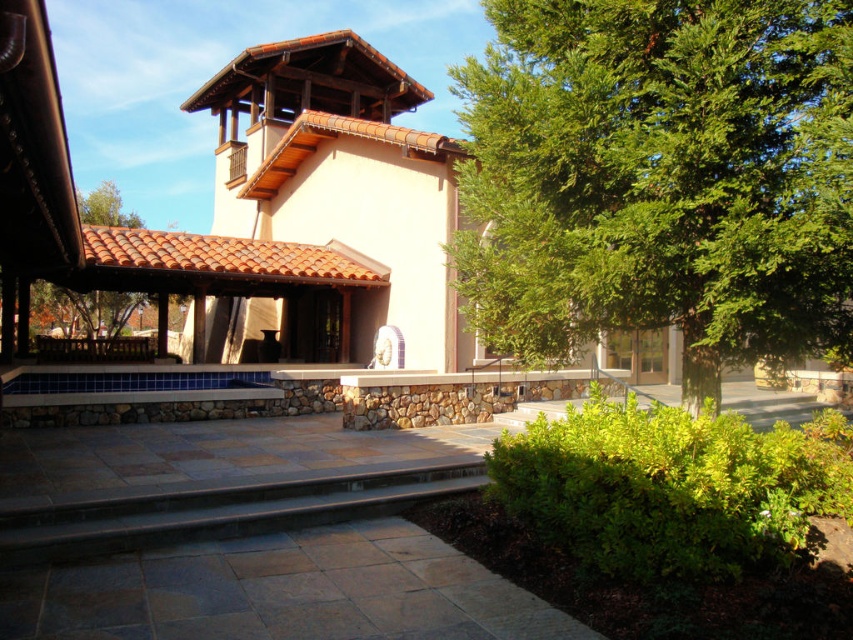
You are standing at the bottom of the dark gray stone stairs at lower center and want to reach the green leafy tree at center. Which direction should you move in to get closer to the tree?

The green leafy tree at center is located above the dark gray stone stairs at lower center, so you should move upward to get closer to the tree.

You are standing at the entrance of the building and want to plant a new shrub exactly 1 meter to the north of the green leafy tree at center. Given the coordinates provided, is this location within the landscaped area described in the scene?

The green leafy tree at center is located at coordinates point [660,177]. Since the landscaped area includes the tree and the surrounding shrubs, planting a shrub 1 meter north of the tree would still be within the landscaped area described in the scene.